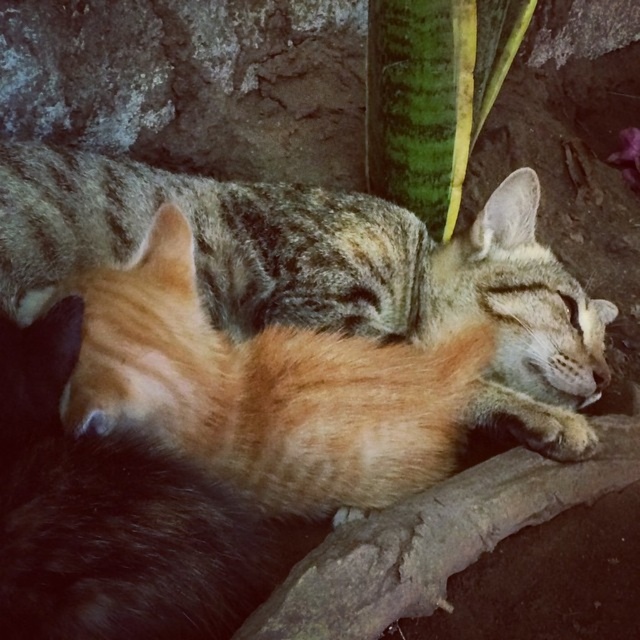
You are a photographer trying to capture a closeup of the orange fur cat at center. However, there is a green textured leaf at upper center in the way. Can you adjust your camera angle to take the photo without the leaf blocking the cat?

The orange fur cat at center is positioned under the green textured leaf at upper center, so tilting the camera slightly downward or moving to the side should allow you to capture the cat without the leaf blocking it.

You are a photographer trying to capture a closeup of the orange fur cat at center without including the green textured leaf at upper center in the frame. Based on their positions, is it possible to adjust your camera angle to achieve this?

The orange fur cat at center is to the left of the green textured leaf at upper center. By moving the camera angle slightly to the right, you can focus on the orange fur cat at center while excluding the green textured leaf at upper center from the shot.

You are a photographer trying to capture both cats in a single shot. The camera is positioned at your eye level, and you notice two points marked on the viewfinder corresponding to the cats. The first point is labeled as point (241,198), and the second is point (486,90). Which point is closer to the camera?

Point (241,198) is in front of point (486,90), so it is closer to the camera.